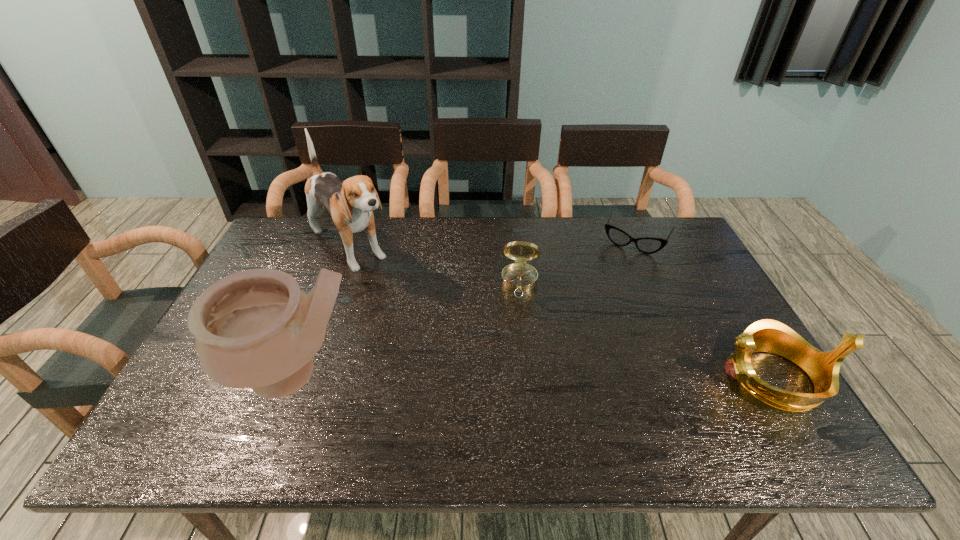
I want to click on vacant space on the desktop that is between the pottery and the tiara and is positioned at the face of the puppy, so pyautogui.click(x=487, y=376).

The height and width of the screenshot is (540, 960). Identify the location of vacant space on the desktop that is between the pottery and the tiara and is positioned with the dial facing the compass. (515, 376).

Where is `free spot on the desktop that is between the pottery and the tiara and is positioned on the front-facing side of the shortest object`? The image size is (960, 540). free spot on the desktop that is between the pottery and the tiara and is positioned on the front-facing side of the shortest object is located at coordinates (575, 377).